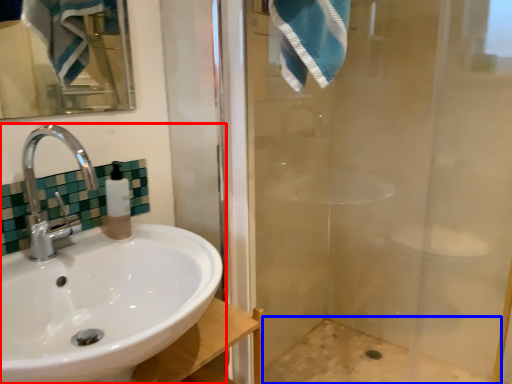
Question: Among these objects, which one is nearest to the camera, sink (highlighted by a red box) or bath (highlighted by a blue box)?

Choices:
 (A) sink
 (B) bath

Answer: (A)